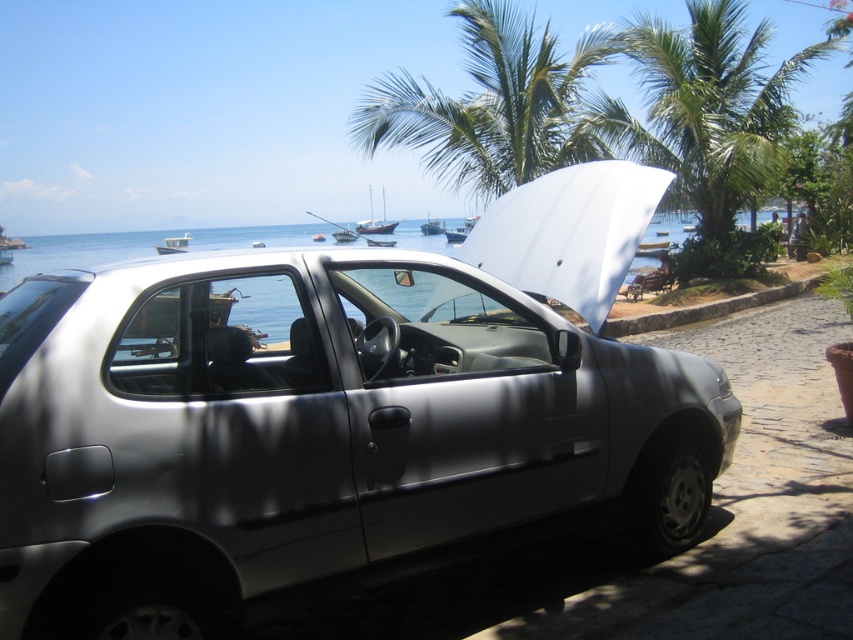
Question: Estimate the real-world distances between objects in this image. Which object is closer to the green leafy palm tree at upper center?

Choices:
 (A) satin silver car at center
 (B) white glossy boat at center
 (C) wooden sailboat at center
 (D) green leafy palm tree at upper right

Answer: (D)

Question: Is satin silver car at center to the right of white glossy boat at center from the viewer's perspective?

Choices:
 (A) yes
 (B) no

Answer: (A)

Question: Which point appears closest to the camera in this image?

Choices:
 (A) click(422, 225)
 (B) click(750, 76)
 (C) click(532, 84)

Answer: (C)

Question: Which of these objects is positioned closest to the green leafy palm tree at upper right?

Choices:
 (A) white glossy boat at center
 (B) satin silver car at center

Answer: (B)

Question: Does satin silver car at center appear over green leafy palm tree at upper right?

Choices:
 (A) yes
 (B) no

Answer: (B)

Question: Does green leafy palm tree at upper right have a larger size compared to white glossy boat at center?

Choices:
 (A) no
 (B) yes

Answer: (A)